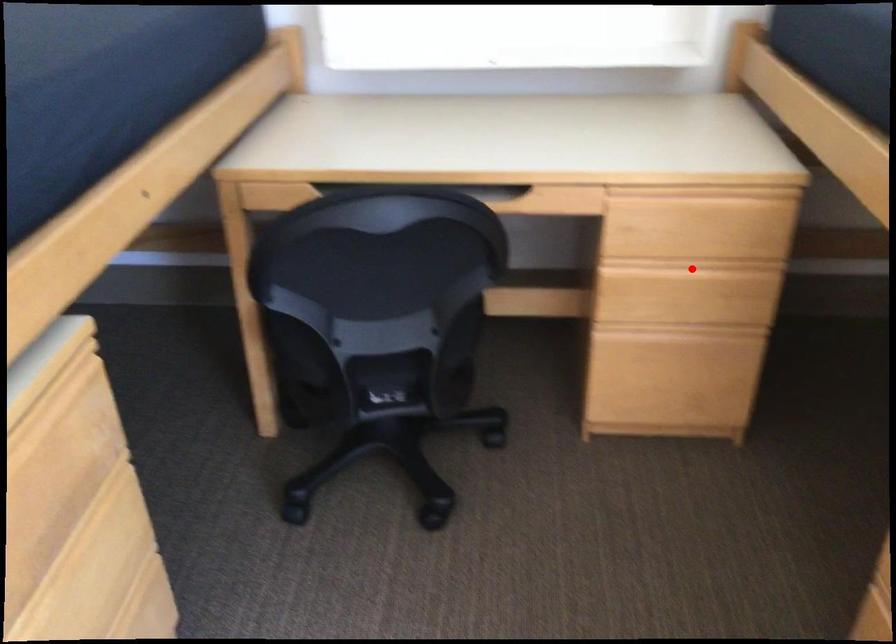
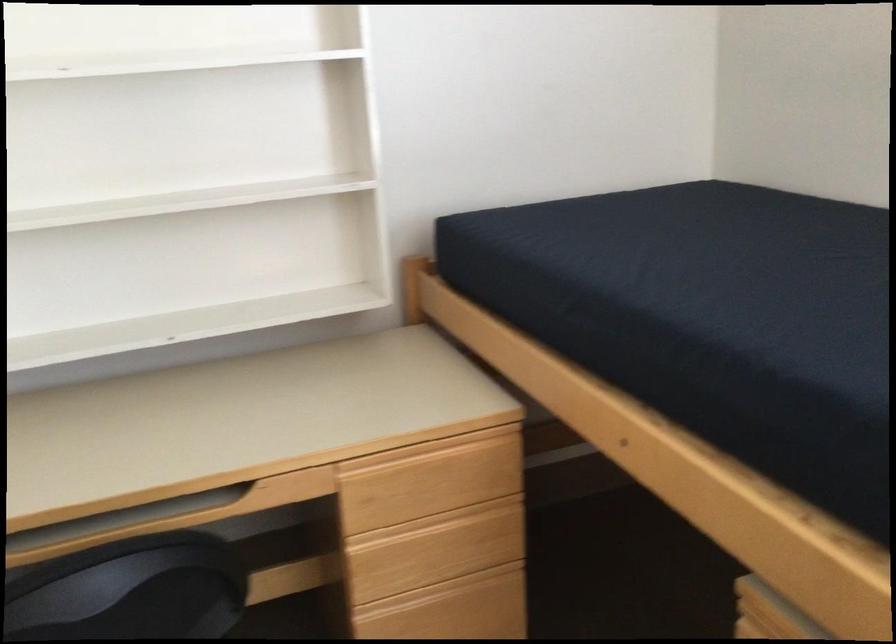
Question: I am providing you with two images of the same scene from different viewpoints. A red point is marked on the first image. Can you still see the location of the red point in image 2?

Choices:
 (A) Yes
 (B) No

Answer: (A)